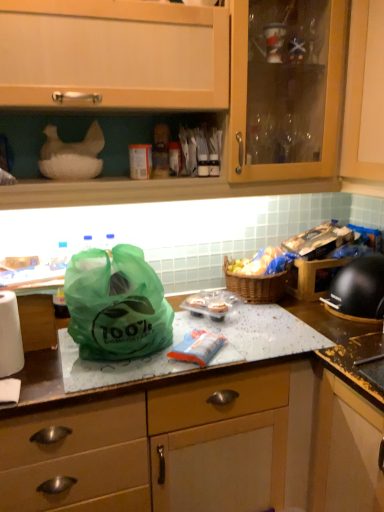
Question: Does green plastic bag at center come in front of transparent glass countertop at center?

Choices:
 (A) no
 (B) yes

Answer: (A)

Question: Considering the relative positions of green plastic bag at center and transparent glass countertop at center in the image provided, is green plastic bag at center behind transparent glass countertop at center?

Choices:
 (A) yes
 (B) no

Answer: (A)

Question: Does green plastic bag at center have a greater width compared to transparent glass countertop at center?

Choices:
 (A) no
 (B) yes

Answer: (A)

Question: Does green plastic bag at center have a larger size compared to transparent glass countertop at center?

Choices:
 (A) no
 (B) yes

Answer: (A)

Question: Does green plastic bag at center appear on the left side of transparent glass countertop at center?

Choices:
 (A) no
 (B) yes

Answer: (B)

Question: Can you confirm if green plastic bag at center is taller than transparent glass countertop at center?

Choices:
 (A) no
 (B) yes

Answer: (A)

Question: Does woven brown picnic basket at center have a lesser width compared to transparent glass countertop at center?

Choices:
 (A) no
 (B) yes

Answer: (B)

Question: From a real-world perspective, is woven brown picnic basket at center on transparent glass countertop at center?

Choices:
 (A) no
 (B) yes

Answer: (B)

Question: Can you confirm if woven brown picnic basket at center is bigger than transparent glass countertop at center?

Choices:
 (A) no
 (B) yes

Answer: (A)

Question: Is woven brown picnic basket at center closer to the viewer compared to transparent glass countertop at center?

Choices:
 (A) yes
 (B) no

Answer: (B)

Question: From the image's perspective, is woven brown picnic basket at center on top of transparent glass countertop at center?

Choices:
 (A) yes
 (B) no

Answer: (A)

Question: Can you confirm if woven brown picnic basket at center is positioned to the right of transparent glass countertop at center?

Choices:
 (A) yes
 (B) no

Answer: (A)

Question: Does wooden cabinet at upper center have a lesser height compared to green plastic bag at center?

Choices:
 (A) no
 (B) yes

Answer: (A)